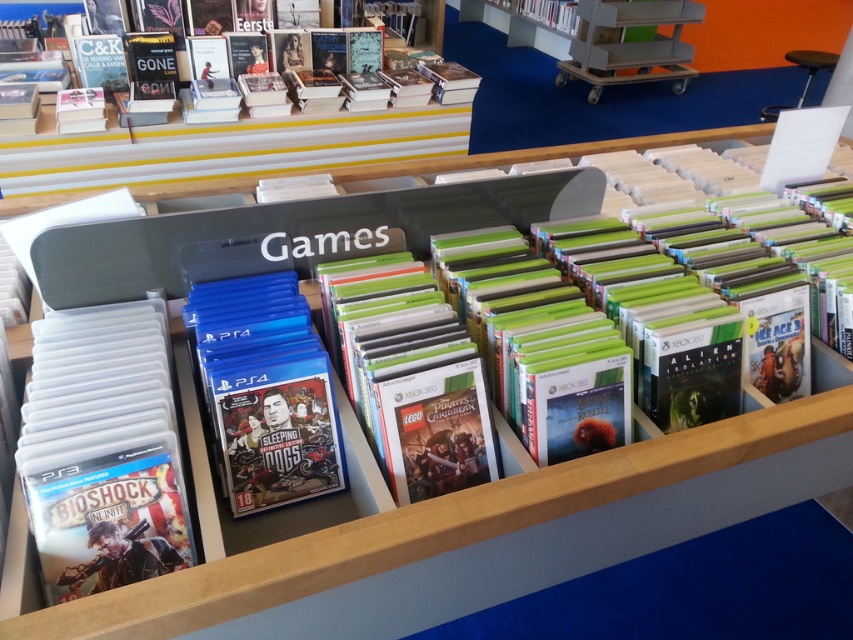
Question: Which is farther from the clear plastic case at left?

Choices:
 (A) hardcover book at upper center
 (B) blue plastic game case at center

Answer: (A)

Question: Is clear plastic case at left wider than blue plastic game case at center?

Choices:
 (A) yes
 (B) no

Answer: (A)

Question: Which object is farther from the camera taking this photo?

Choices:
 (A) clear plastic case at left
 (B) blue plastic game case at center

Answer: (B)

Question: Which point is closer to the camera taking this photo?

Choices:
 (A) (103, 360)
 (B) (206, 376)

Answer: (A)

Question: Does blue plastic game case at center appear over hardcover book at upper center?

Choices:
 (A) yes
 (B) no

Answer: (B)

Question: In this image, where is clear plastic case at left located relative to hardcover book at upper center?

Choices:
 (A) right
 (B) left

Answer: (B)